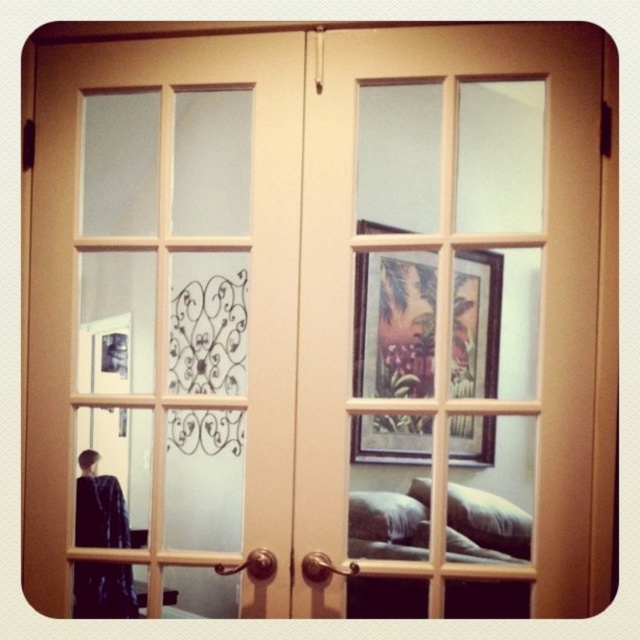
Which of these two, soft beige pillow at lower right or white soft pillow at lower right, stands shorter?

white soft pillow at lower right

Can you confirm if soft beige pillow at lower right is taller than white soft pillow at lower right?

Correct, soft beige pillow at lower right is much taller as white soft pillow at lower right.

Identify the location of soft beige pillow at lower right. (488, 520).

Does matte wood door at center have a lesser height compared to white soft pillow at lower right?

Incorrect, matte wood door at center's height does not fall short of white soft pillow at lower right's.

Locate an element on the screen. matte wood door at center is located at coordinates (166, 308).

Find the location of a particular element. The image size is (640, 640). matte wood door at center is located at coordinates point(166,308).

Is matte wood door at center smaller than dark blue fabric at lower left?

No, matte wood door at center is not smaller than dark blue fabric at lower left.

Who is more distant from viewer, (273, 371) or (90, 509)?

The point (90, 509) is more distant.

The image size is (640, 640). I want to click on matte wood door at center, so click(x=166, y=308).